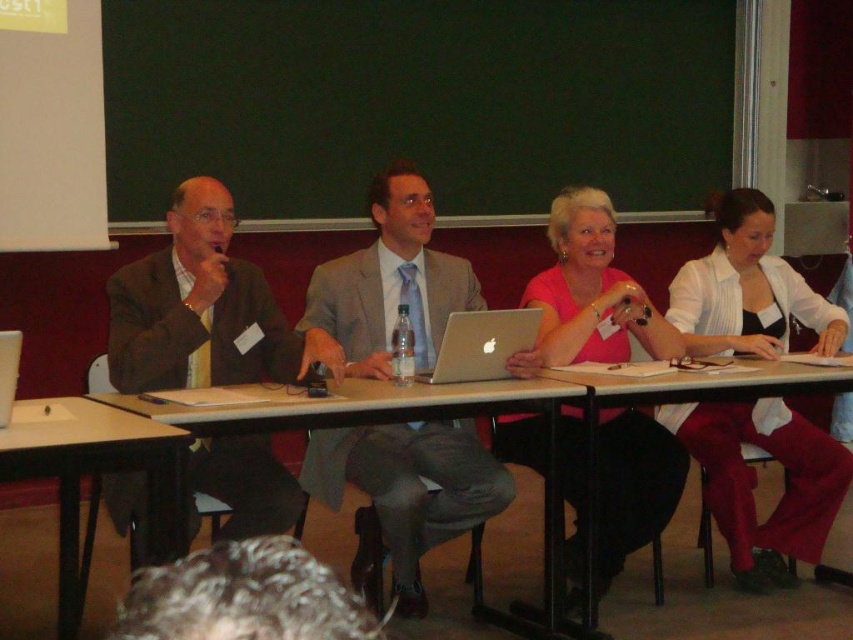
Does matte brown suit at left have a lesser width compared to wooden table at lower left?

In fact, matte brown suit at left might be wider than wooden table at lower left.

Which is in front, point (224, 248) or point (149, 484)?

Point (149, 484) is more forward.

Find the location of `matte brown suit at left`. matte brown suit at left is located at coordinates (202, 308).

Is point (146, 344) farther from viewer compared to point (183, 428)?

Yes, point (146, 344) is behind point (183, 428).

Is matte brown suit at left closer to camera compared to white plastic table at center?

No.

Does point (169, 284) come behind point (117, 396)?

Yes, it is.

Where is `matte brown suit at left`? This screenshot has height=640, width=853. matte brown suit at left is located at coordinates (202, 308).

Can you confirm if green chalkboard at upper center is positioned to the left of wooden table at lower right?

Indeed, green chalkboard at upper center is positioned on the left side of wooden table at lower right.

Between point (366, 179) and point (590, 381), which one is positioned behind?

Positioned behind is point (366, 179).

Where is `green chalkboard at upper center`? The width and height of the screenshot is (853, 640). green chalkboard at upper center is located at coordinates (416, 100).